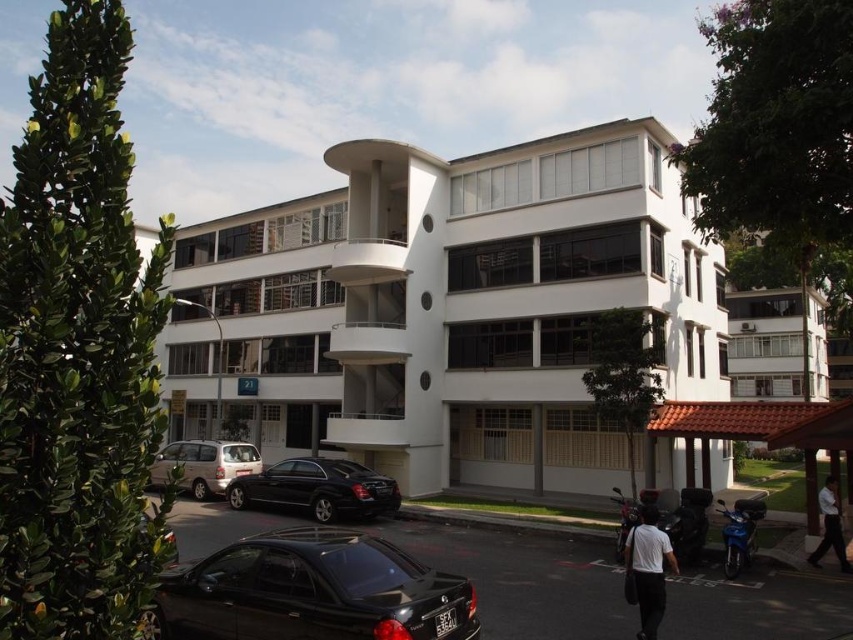
Question: Which point is farther from the camera taking this photo?

Choices:
 (A) (653, 570)
 (B) (376, 497)
 (C) (827, 525)

Answer: (B)

Question: Which of these objects is positioned farthest from the white matte shirt at lower right?

Choices:
 (A) shiny black car at lower center
 (B) white smooth shirt at lower right
 (C) shiny black sedan at center
 (D) white smooth building at center

Answer: (D)

Question: Which of the following is the closest to the observer?

Choices:
 (A) white matte shirt at lower right
 (B) white smooth shirt at lower right
 (C) silver metallic minivan at lower left

Answer: (C)

Question: Can you confirm if white matte shirt at lower right is positioned above white smooth shirt at lower right?

Choices:
 (A) no
 (B) yes

Answer: (B)

Question: Is shiny black sedan at center to the right of white matte shirt at lower right from the viewer's perspective?

Choices:
 (A) yes
 (B) no

Answer: (B)

Question: Does silver metallic minivan at lower left have a greater width compared to white smooth shirt at lower right?

Choices:
 (A) no
 (B) yes

Answer: (B)